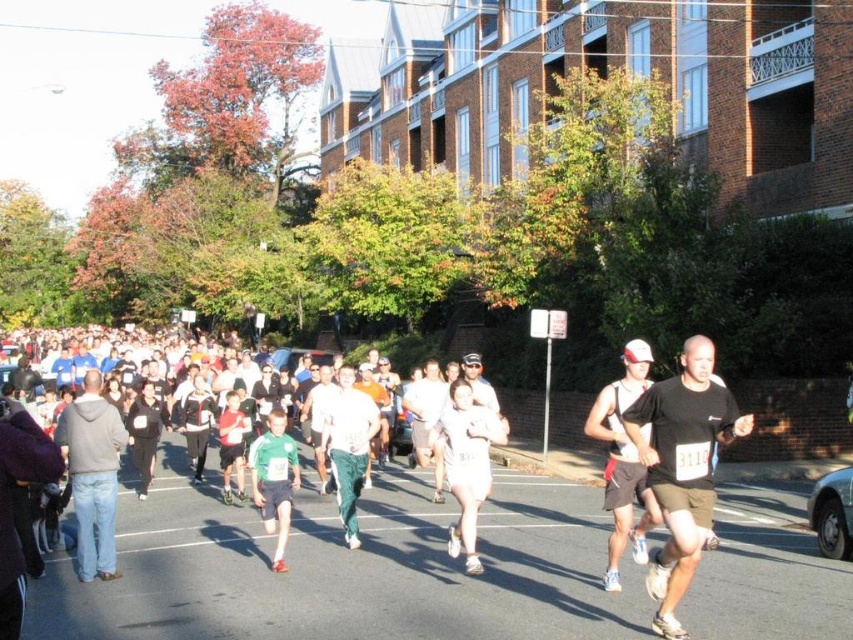
You are a photographer positioned at the starting line of the marathon. You want to take a photo that includes both the point at coordinates point (363,456) and point (332,381). Which point should you focus on first to ensure both are in sharp focus?

You should focus on point (363,456) first because it is closer to the camera, ensuring both points will be in focus when using a proper depth of field.

Consider the image. You are a photographer positioned at the starting line of the marathon. You want to capture a photo of the black matte shirt at center and the green fabric shorts at center in the same frame. Given that your camera has a maximum focus range of 10 meters, will both subjects be in focus?

The black matte shirt at center and green fabric shorts at center are 10.35 meters apart. Since the distance between them exceeds the camera focus range of 10 meters, they might not both be in focus simultaneously.